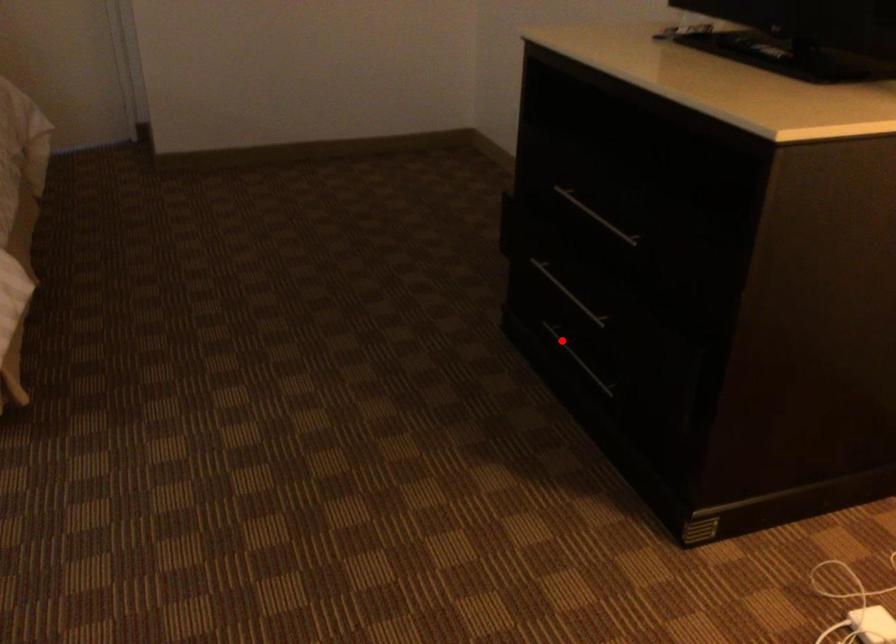
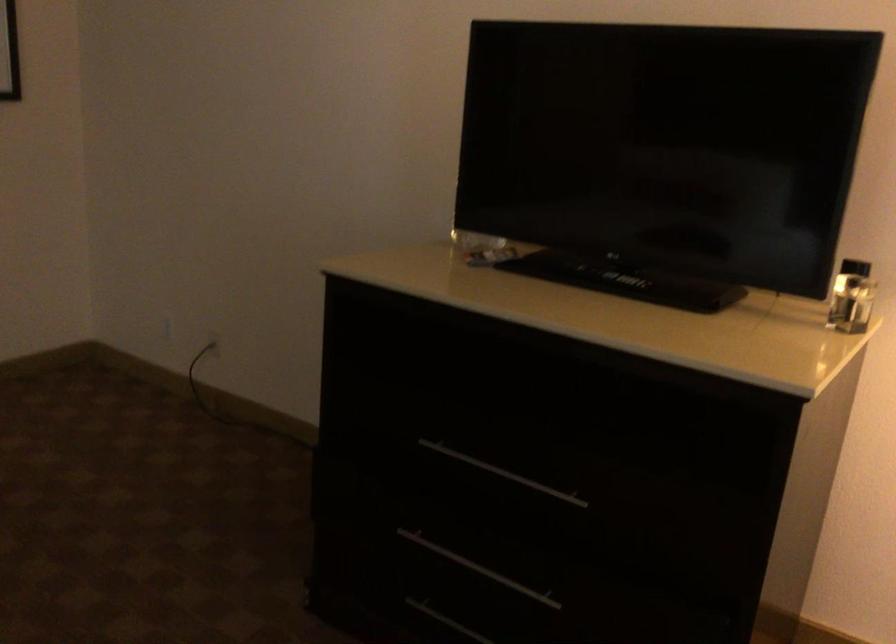
Find the pixel in the second image that matches the highlighted location in the first image.

(446, 621)